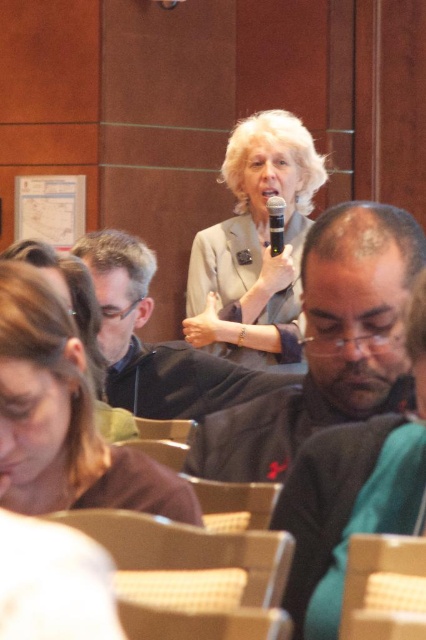
You are standing in the conference room and want to determine the relative positions of two points marked in the scene. Which of the two points, point 1 at coordinates (20, 410) or point 2 at coordinates (196, 397), is closer to you?

Point 1 at coordinates (20, 410) is closer to the viewer than point 2 at coordinates (196, 397).

You are organizing a photo shoot and need to ensure that the matte black hair at lower left and the matte black jacket at center are visible in the frame. Based on their sizes, which object should you prioritize keeping within the camera frame?

The matte black hair at lower left has a lesser width compared to the matte black jacket at center, so you should prioritize keeping the matte black jacket at center in the frame since it is larger and more prominent.